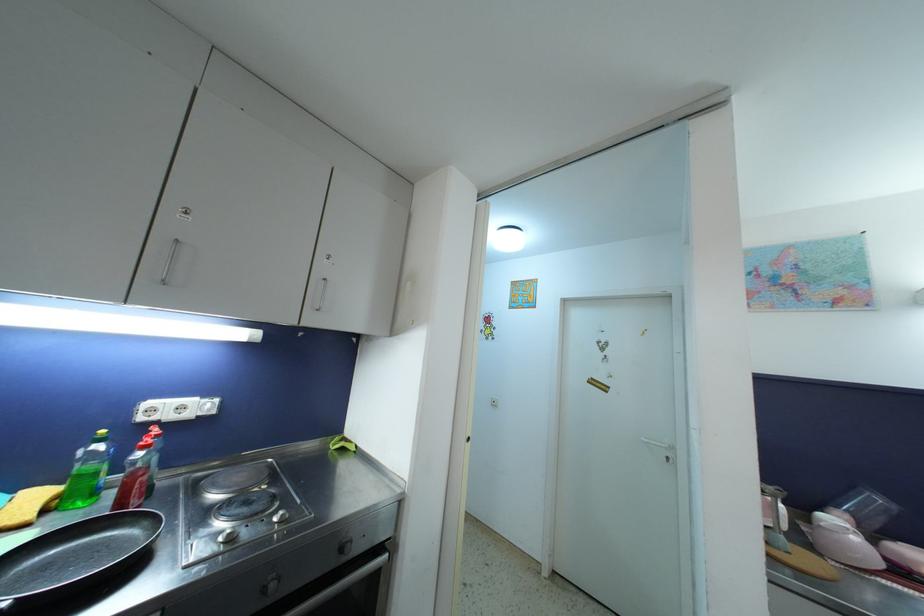
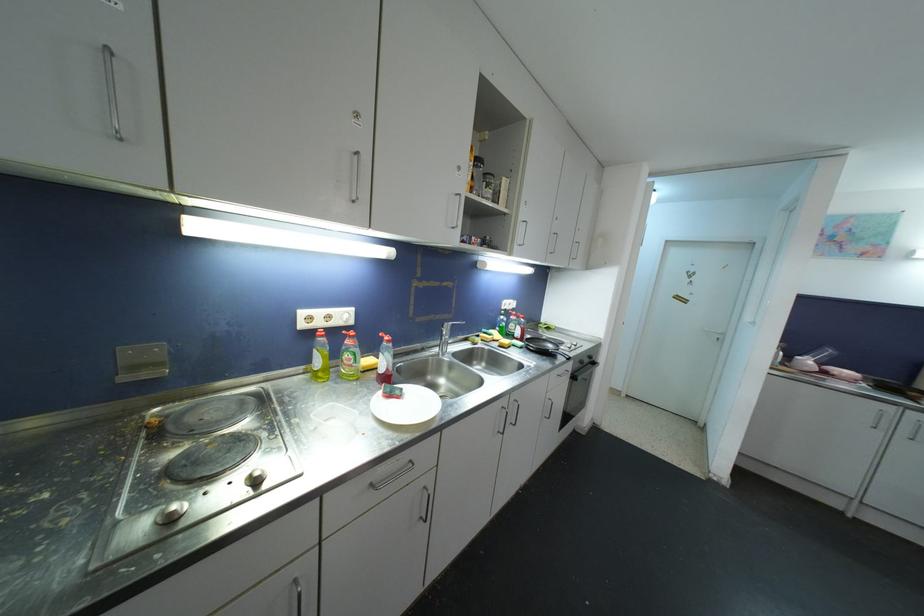
Which direction would the cameraman need to move to produce the second image?

The cameraman walked toward left, backward.